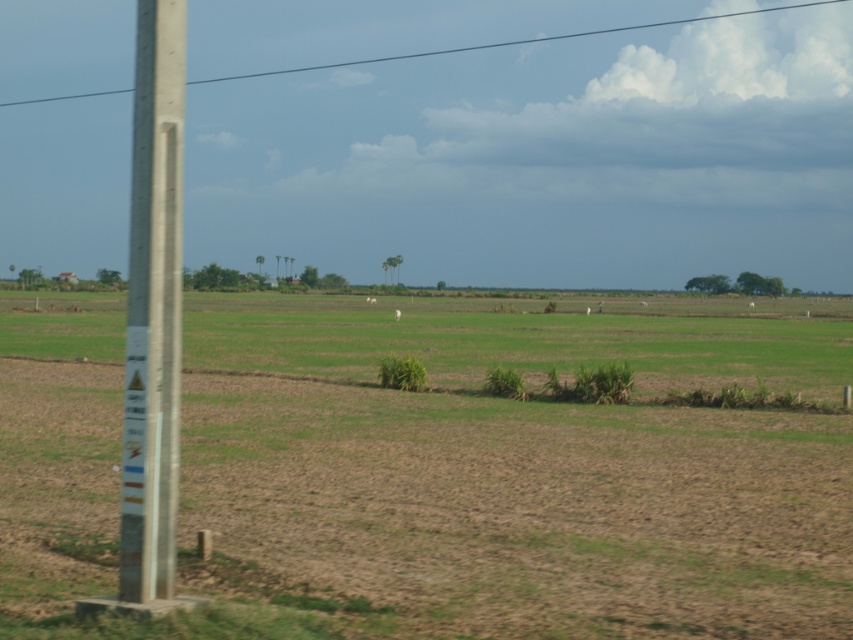
You are a farmer checking the electrical setup in your field. You notice the concrete pole at left and the smooth concrete power line at upper center. Which object is nearer to you?

The concrete pole at left is closer to the viewer than the smooth concrete power line at upper center, so the concrete pole at left is nearer to you.